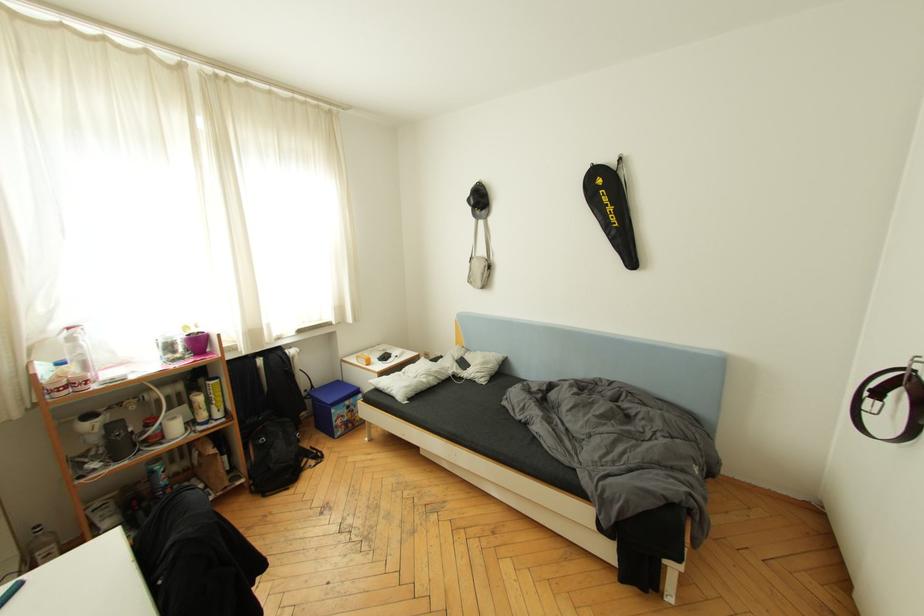
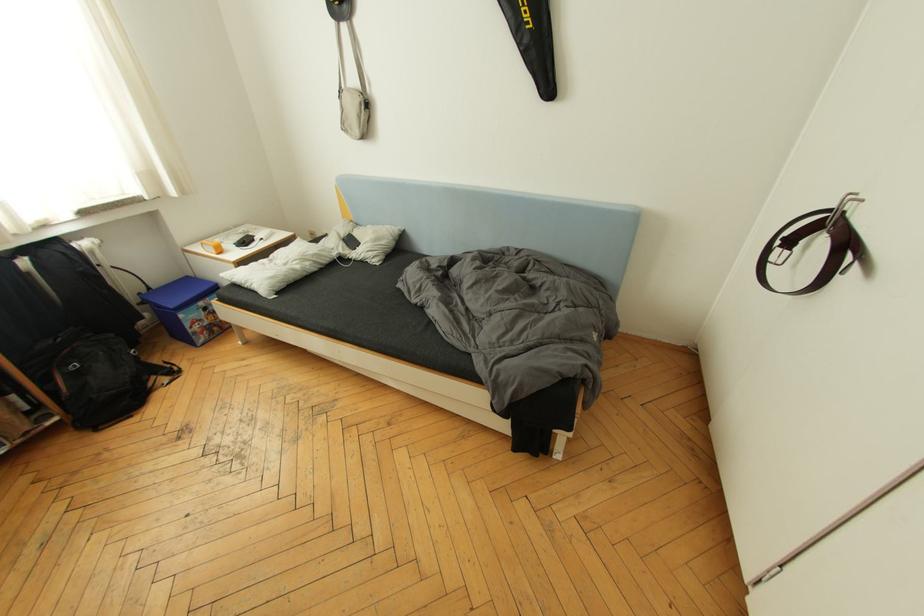
The images are taken continuously from a first-person perspective. In which direction are you moving?

The cameraman walked toward right, forward.